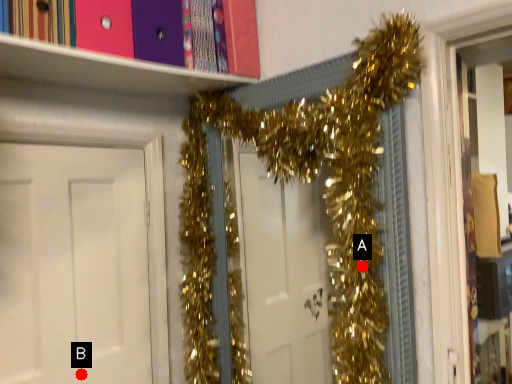
Question: Two points are circled on the image, labeled by A and B beside each circle. Which point is closer to the camera taking this photo?

Choices:
 (A) A is closer
 (B) B is closer

Answer: (A)